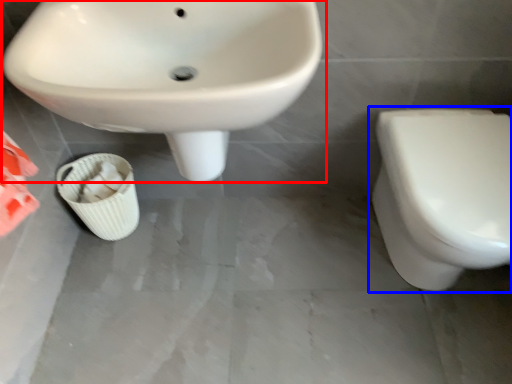
Question: Which object is closer to the camera taking this photo, sink (highlighted by a red box) or toilet (highlighted by a blue box)?

Choices:
 (A) sink
 (B) toilet

Answer: (A)